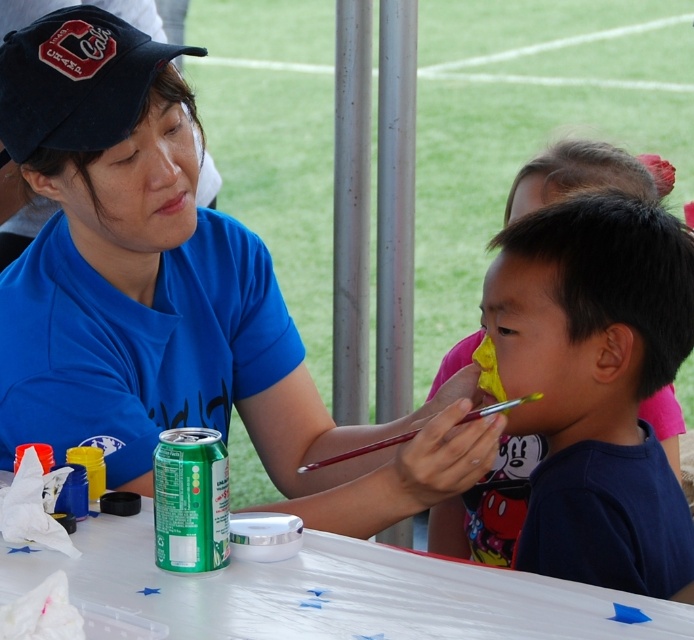
You are a painter who needs to reach for your tools. You are currently standing 1 meter away from the blue fabric shirt at upper left and green matte can at lower left. If you want to grab the closest item to your current position, which one should you choose?

The distance between the blue fabric shirt at upper left and the green matte can at lower left is 39.48 centimeters. Since you are 1 meter away from both items, you should grab whichever is closer to your current position. However, the description only provides the distance between the two objects, not their individual distances from you. Therefore, it is impossible to determine which one is closer to you based on the given information.

You are a photographer setting up for an event and need to place a small tripod between the black fabric cap at upper left and the green matte can at lower left. Which object should you position the tripod closer to if you want it to be near the larger object?

The black fabric cap at upper left is larger than the green matte can at lower left, so you should position the tripod closer to the black fabric cap at upper left.

You are organizing a community event and need to know which item takes up more space between the blue fabric shirt at upper left and the green matte can at lower left. Which one is bigger?

The blue fabric shirt at upper left has a larger size compared to the green matte can at lower left, so the blue fabric shirt at upper left takes up more space.